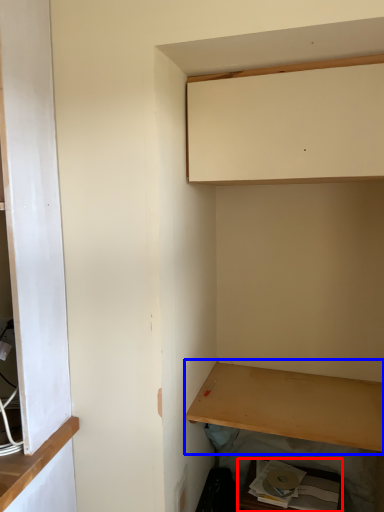
Question: Which object appears farthest to the camera in this image, cabinetry (highlighted by a red box) or shelf (highlighted by a blue box)?

Choices:
 (A) cabinetry
 (B) shelf

Answer: (A)